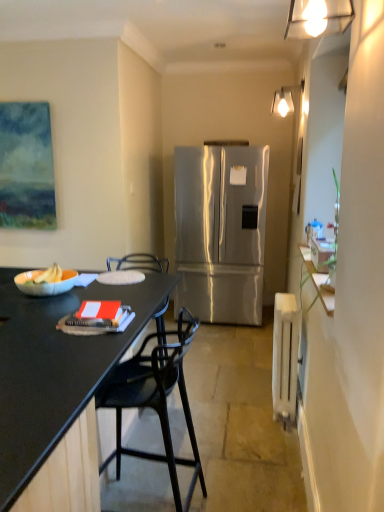
Question: Based on their sizes in the image, would you say black matte desk at left is bigger or smaller than black plastic chair at left?

Choices:
 (A) small
 (B) big

Answer: (B)

Question: Considering the positions of black matte desk at left and black plastic chair at left in the image, is black matte desk at left taller or shorter than black plastic chair at left?

Choices:
 (A) short
 (B) tall

Answer: (A)

Question: Which is nearer to the matte white light fixture at upper right, which is the first lamp in front-to-back order?

Choices:
 (A) matte white bowl at left
 (B) orange matte book at left
 (C) stainless steel refrigerator at center
 (D) matte white light fixture at upper center, the 1th lamp viewed from the right
 (E) black plastic chair at left

Answer: (B)

Question: Based on their relative distances, which object is farther from the orange matte book at left?

Choices:
 (A) matte white light fixture at upper center, the second lamp in the bottom-to-top sequence
 (B) stainless steel refrigerator at center
 (C) black plastic chair at left
 (D) black matte desk at left
 (E) white plastic radiator at right

Answer: (A)